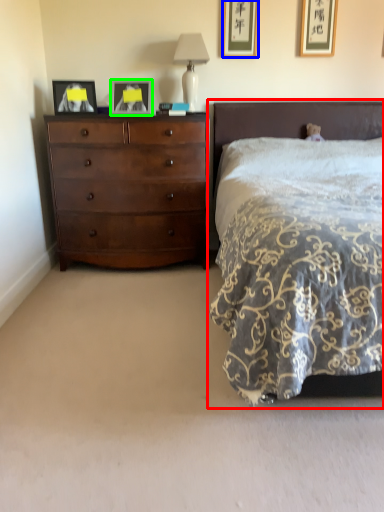
Question: Which object is positioned closest to bed (highlighted by a red box)? Select from picture frame (highlighted by a blue box) and picture frame (highlighted by a green box).

Choices:
 (A) picture frame
 (B) picture frame

Answer: (A)